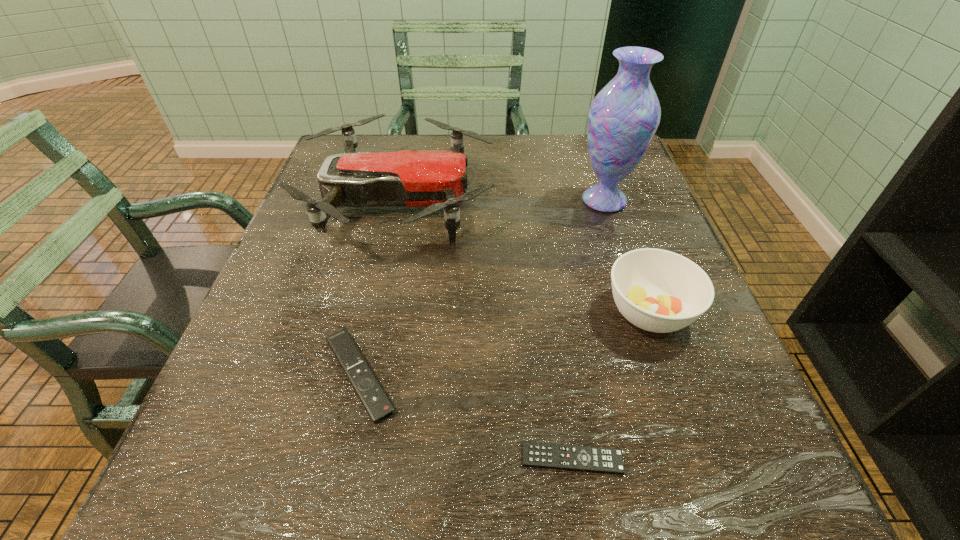
You are a GUI agent. You are given a task and a screenshot of the screen. Output one action in this format:
    pyautogui.click(x=<x>, y=<y>)
    Task: Click on the vase
    
    Given the screenshot: What is the action you would take?
    pyautogui.click(x=623, y=118)

Locate an element on the screen. Image resolution: width=960 pixels, height=540 pixels. the second tallest object is located at coordinates (436, 179).

Image resolution: width=960 pixels, height=540 pixels. In order to click on the third shortest object in this screenshot , I will do `click(660, 291)`.

The height and width of the screenshot is (540, 960). I want to click on the fourth tallest object, so click(375, 401).

The image size is (960, 540). I want to click on the taller remote control, so click(375, 401).

Identify the location of the nearest object. click(535, 454).

Where is `the shortest object`? Image resolution: width=960 pixels, height=540 pixels. the shortest object is located at coordinates (535, 454).

Where is `free space located on the back of the tallest object`? free space located on the back of the tallest object is located at coordinates (582, 133).

Where is `vacant space situated 0.070m on the front-facing side of the second tallest object`? This screenshot has height=540, width=960. vacant space situated 0.070m on the front-facing side of the second tallest object is located at coordinates (523, 202).

Identify the location of free space located 0.330m on the left of the soup bowl. The width and height of the screenshot is (960, 540). (419, 312).